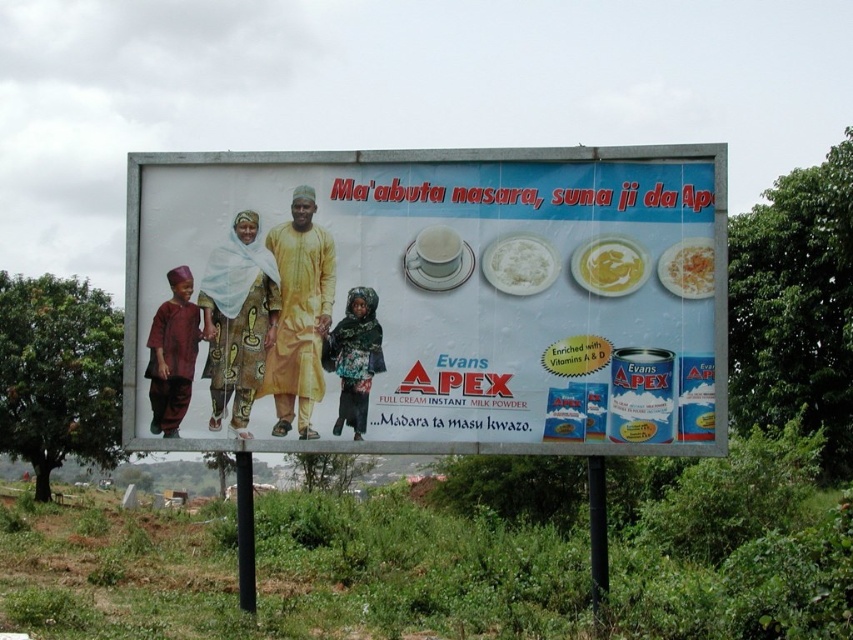
You are a delivery driver who needs to deliver a package to the location marked at point (519, 264). The package contains a white powder. Is there already a white powder present at that location?

Yes, there is already a white powder present at point (519, 264) as described in the scene.

You are a delivery driver who needs to place a new sign on the billboard. The sign must go below the white powder at upper center and above the yellow creamy sauce at upper center. Is there enough space between them to fit the sign?

The white powder at upper center is located above the yellow creamy sauce at upper center, so there is space between them to place the new sign below the white powder at upper center and above the yellow creamy sauce at upper center.